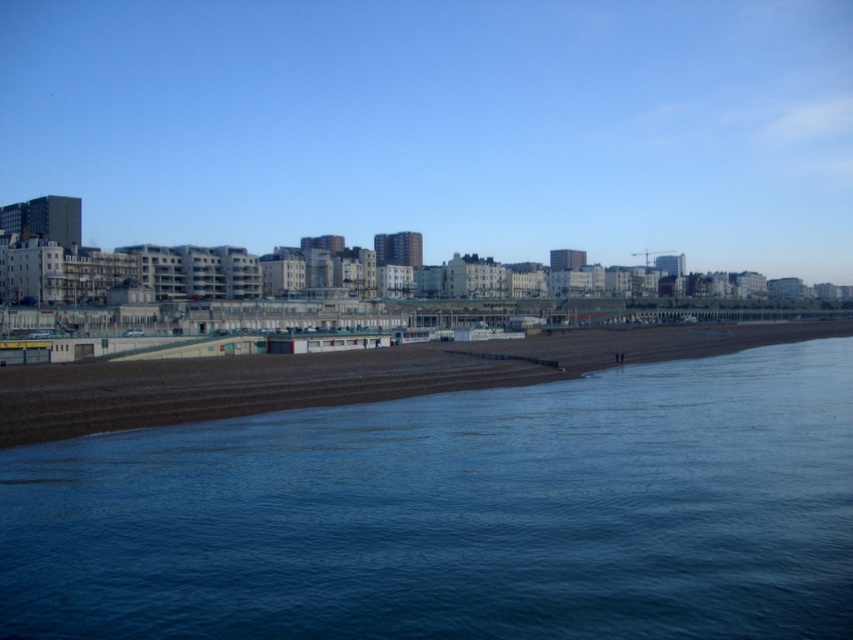
Question: Is blue water at center above brown sand at center?

Choices:
 (A) yes
 (B) no

Answer: (B)

Question: Is blue water at center positioned at the back of brown sand at center?

Choices:
 (A) no
 (B) yes

Answer: (A)

Question: Is the position of blue water at center more distant than that of brown sand at center?

Choices:
 (A) yes
 (B) no

Answer: (B)

Question: Which point appears closest to the camera in this image?

Choices:
 (A) (370, 472)
 (B) (74, 429)

Answer: (A)

Question: Which point appears closest to the camera in this image?

Choices:
 (A) (831, 570)
 (B) (656, 353)

Answer: (A)